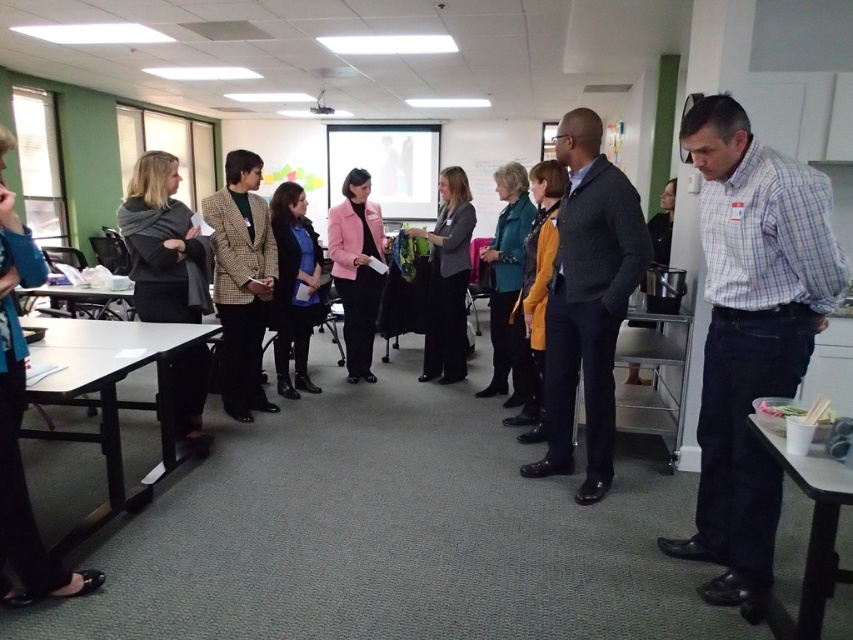
Question: Is blue plaid shirt at right thinner than teal fabric jacket at center?

Choices:
 (A) no
 (B) yes

Answer: (A)

Question: Estimate the real-world distances between objects in this image. Which object is farther from the plaid wool blazer at center?

Choices:
 (A) white plastic table at left
 (B) blue fabric jacket at center
 (C) gray wool scarf at left
 (D) blue plaid shirt at right

Answer: (D)

Question: Which object is the farthest from the knit sweater at center?

Choices:
 (A) pink matte blazer at center
 (B) teal fabric jacket at center
 (C) matte gray blazer at center
 (D) white plastic table at left

Answer: (D)

Question: Is blue plaid shirt at right further to camera compared to matte gray blazer at center?

Choices:
 (A) yes
 (B) no

Answer: (B)

Question: Is gray wool scarf at left behind plaid wool blazer at center?

Choices:
 (A) no
 (B) yes

Answer: (A)

Question: Among these objects, which one is nearest to the camera?

Choices:
 (A) pink matte blazer at center
 (B) white plastic table at left
 (C) teal fabric jacket at center

Answer: (B)